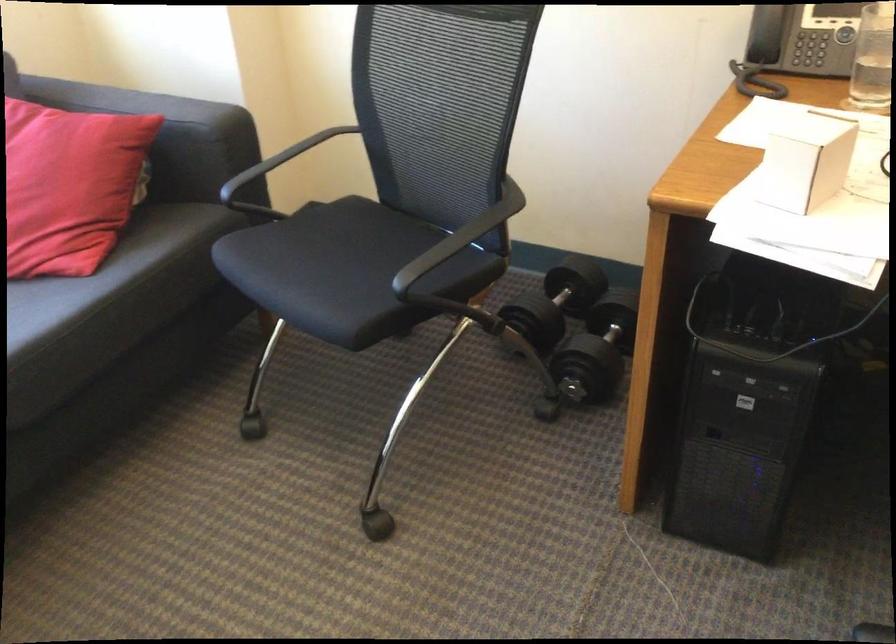
Find where to sit the sofa sitting surface. Please return your answer as a coordinate pair (x, y).

(156, 230)